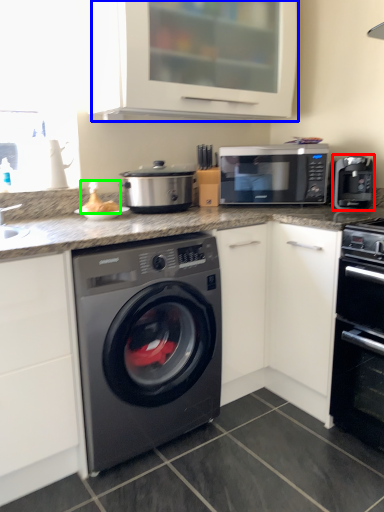
Question: Estimate the real-world distances between objects in this image. Which object is closer to coffee machine (highlighted by a red box), cabinetry (highlighted by a blue box) or food (highlighted by a green box)?

Choices:
 (A) cabinetry
 (B) food

Answer: (A)